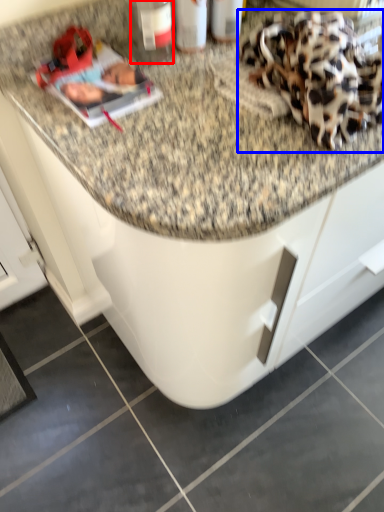
Question: Which object is further to the camera taking this photo, bottle (highlighted by a red box) or stuff (highlighted by a blue box)?

Choices:
 (A) bottle
 (B) stuff

Answer: (A)